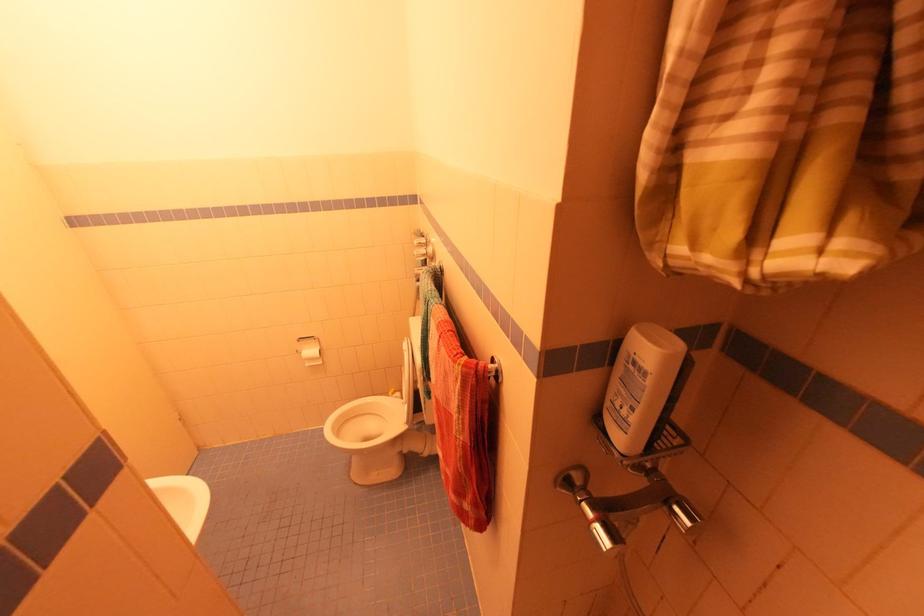
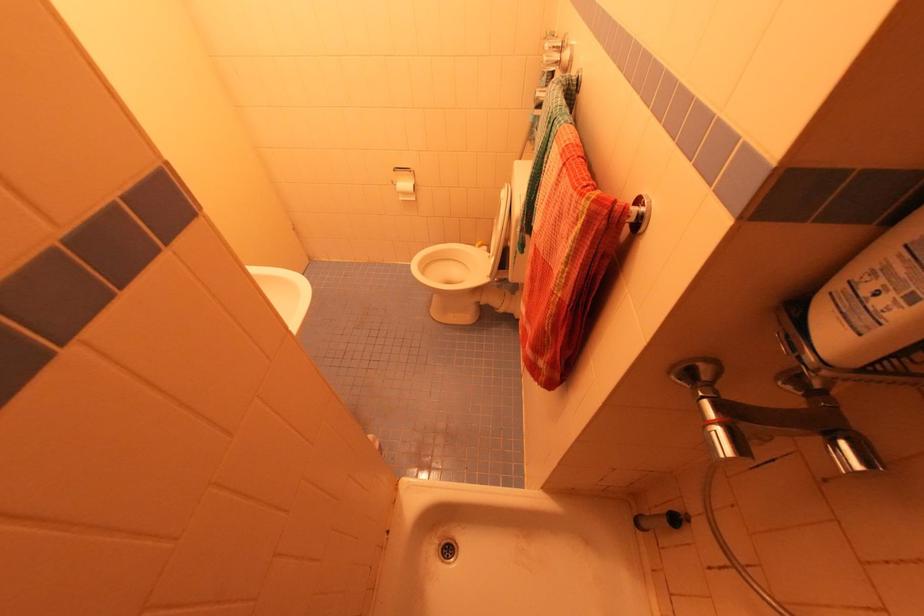
Where in the second image is the point corresponding to (495,374) from the first image?

(635, 222)